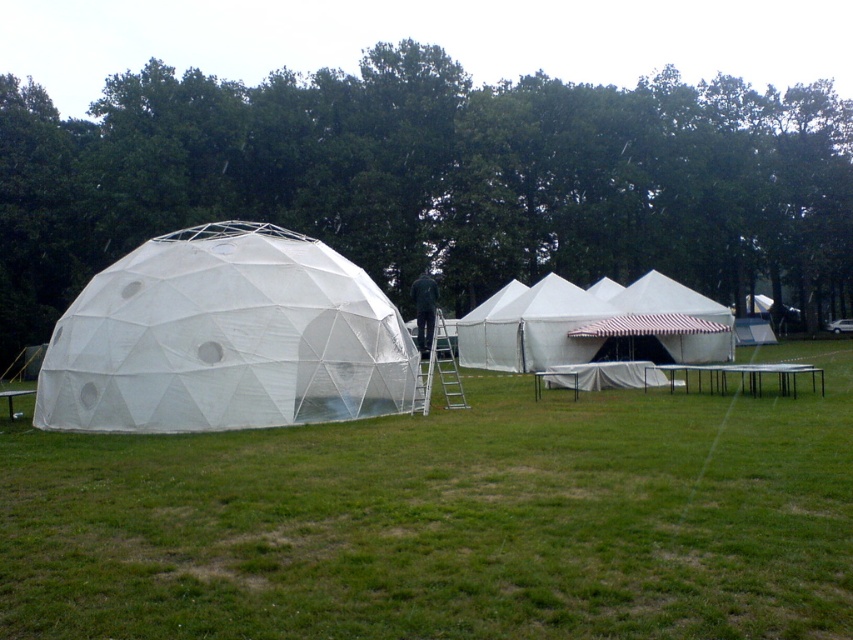
From the picture: You are standing at the point marked as point [625,264] and want to walk towards the geodesic dome tent. Considering the distance between you and the dome, can you estimate how long it would take to reach it if you walk at a normal pace of 1.4 meters per second?

The distance between point [625,264] and the viewer is 58.13 meters. At a walking speed of 1.4 meters per second, it would take approximately 41.5 seconds to reach the geodesic dome tent.

You are planning to set up a picnic blanket under the green leafy tree at upper center and the white canvas tent at center. Which location offers more vertical space above the picnic blanket for standing comfortably?

The green leafy tree at upper center offers more vertical space above the picnic blanket because it is taller than the white canvas tent at center.